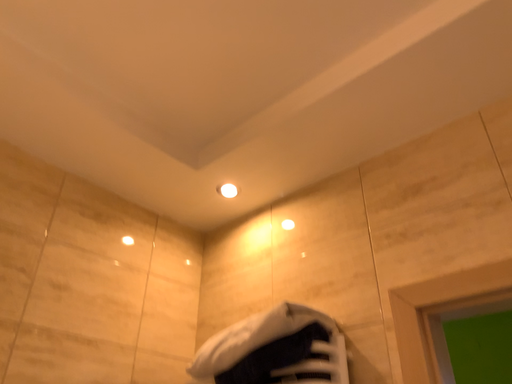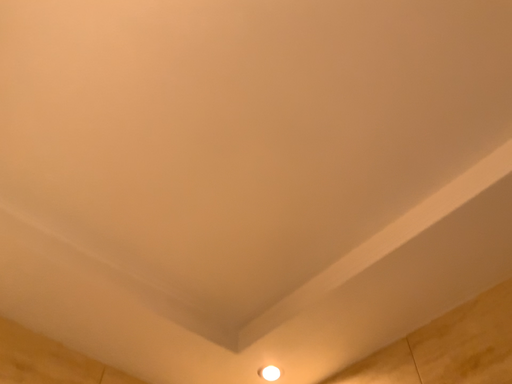
Question: How did the camera likely rotate when shooting the video?

Choices:
 (A) rotated upward
 (B) rotated downward

Answer: (A)